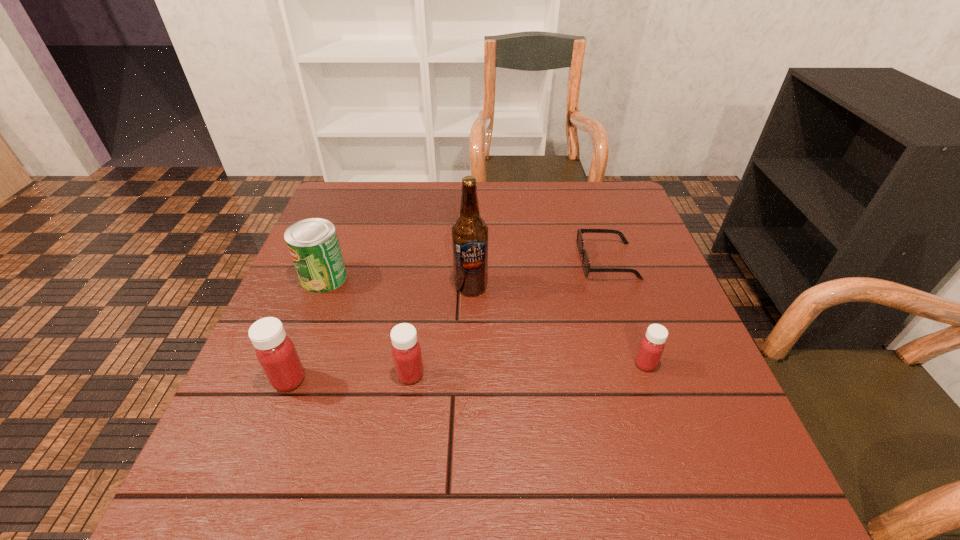
Find the location of a particular element. sunglasses at the right edge is located at coordinates (580, 242).

In the image, there is a desktop. In order to click on vacant area at the far edge in this screenshot , I will do `click(506, 225)`.

Locate an element on the screen. vacant point at the near edge is located at coordinates (323, 439).

You are a GUI agent. You are given a task and a screenshot of the screen. Output one action in this format:
    pyautogui.click(x=<x>, y=<y>)
    Task: Click on the vacant space at the left edge of the desktop
    
    Given the screenshot: What is the action you would take?
    pyautogui.click(x=348, y=270)

Find the location of a particular element. The image size is (960, 540). free space at the right edge is located at coordinates (662, 316).

Identify the location of vacant space at the near left corner. (319, 401).

The width and height of the screenshot is (960, 540). What are the coordinates of `free space at the near right corner of the desktop` in the screenshot? It's located at (717, 437).

The image size is (960, 540). Find the location of `vacant space in between the second medicine from right to left and the fifth tallest object`. vacant space in between the second medicine from right to left and the fifth tallest object is located at coordinates (528, 369).

In order to click on vacant space that's between the can and the third object from right to left in this screenshot , I will do `click(397, 282)`.

Find the location of a particular element. empty space that is in between the can and the leftmost medicine is located at coordinates (306, 328).